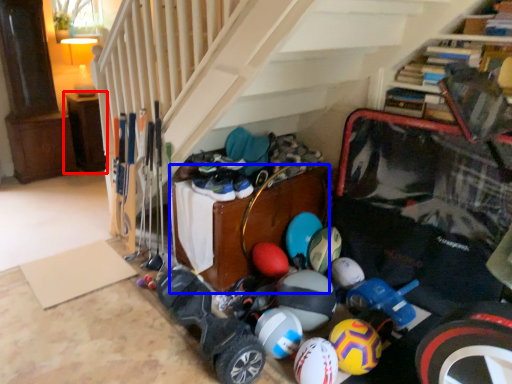
Question: Which point is closer to the camera, furniture (highlighted by a red box) or furniture (highlighted by a blue box)?

Choices:
 (A) furniture
 (B) furniture

Answer: (B)